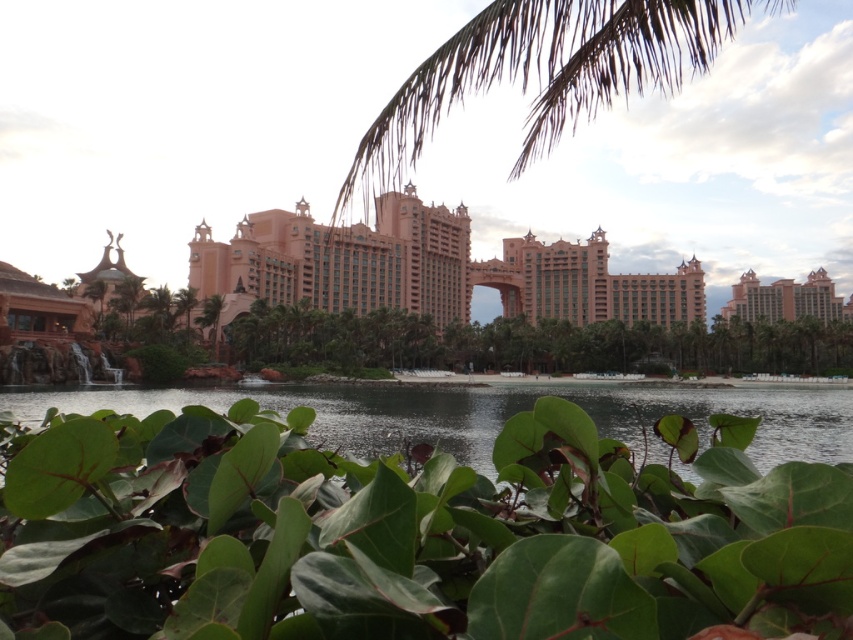
Can you confirm if green matte leaves at lower center is shorter than transparent water at center?

In fact, green matte leaves at lower center may be taller than transparent water at center.

Who is positioned more to the right, green matte leaves at lower center or transparent water at center?

transparent water at center

Is point (299, 522) positioned before point (550, 388)?

That is True.

Image resolution: width=853 pixels, height=640 pixels. I want to click on green matte leaves at lower center, so click(410, 532).

Measure the distance from green leafy palm tree at upper center to transparent water at center.

51.54 meters

Which is behind, point (616, 77) or point (456, 388)?

The point (456, 388) is behind.

Where is `green leafy palm tree at upper center`? green leafy palm tree at upper center is located at coordinates (546, 72).

Is green matte leaves at lower center positioned behind green leafy palm tree at upper center?

No, it is in front of green leafy palm tree at upper center.

Does green matte leaves at lower center have a lesser height compared to green leafy palm tree at upper center?

Yes.

Is point (292, 436) farther from viewer compared to point (592, 99)?

That is False.

Find the location of a particular element. This screenshot has height=640, width=853. green matte leaves at lower center is located at coordinates (410, 532).